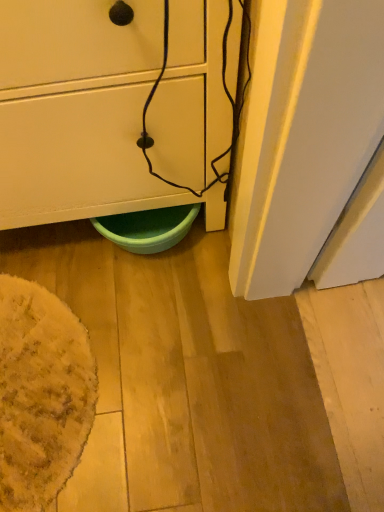
Find the location of `matte white chest of drawers at lower left`. matte white chest of drawers at lower left is located at coordinates (80, 113).

What do you see at coordinates (80, 113) in the screenshot?
I see `matte white chest of drawers at lower left` at bounding box center [80, 113].

Locate an element on the screen. matte white chest of drawers at lower left is located at coordinates (80, 113).